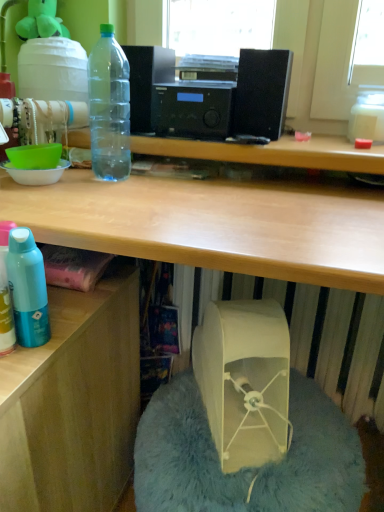
Question: Based on their positions, is transparent plastic water cooler at upper left located to the left or right of transparent plastic bottle at upper left?

Choices:
 (A) right
 (B) left

Answer: (B)

Question: Is transparent plastic water cooler at upper left situated inside transparent plastic bottle at upper left or outside?

Choices:
 (A) outside
 (B) inside

Answer: (A)

Question: Which of these objects is positioned farthest from the wooden desk at lower left?

Choices:
 (A) beige fabric bean bag chair at lower center
 (B) beige fabric bag at lower center
 (C) transparent plastic water cooler at upper left
 (D) transparent plastic bottle at upper left

Answer: (C)

Question: Which is farther from the transparent plastic bottle at upper left?

Choices:
 (A) wooden desk at lower left
 (B) transparent plastic water cooler at upper left
 (C) beige fabric bag at lower center
 (D) beige fabric bean bag chair at lower center

Answer: (D)